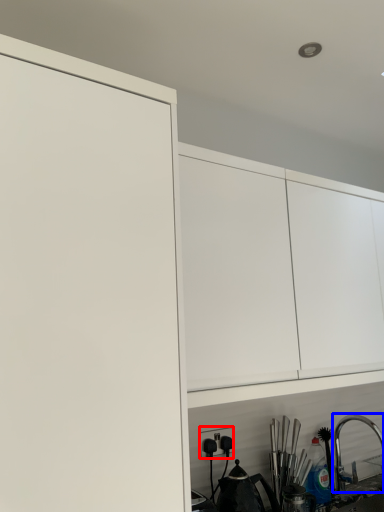
Question: Which object appears closest to the camera in this image, electric outlet (highlighted by a red box) or tap (highlighted by a blue box)?

Choices:
 (A) electric outlet
 (B) tap

Answer: (A)